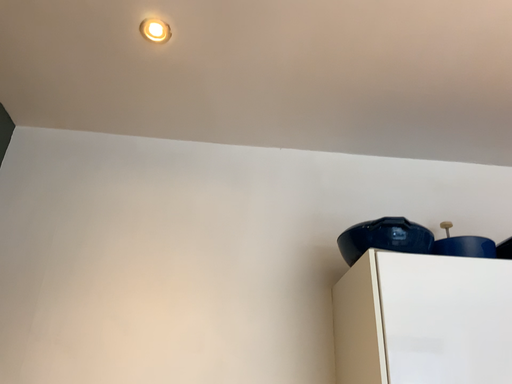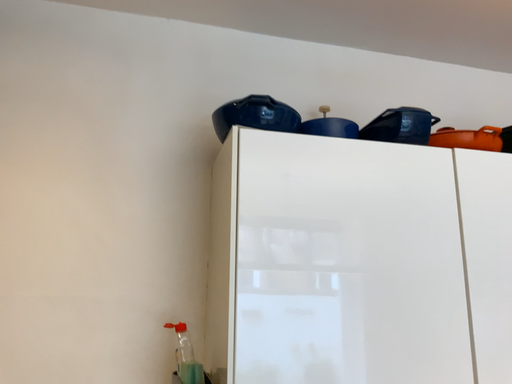
Question: Which way did the camera rotate in the video?

Choices:
 (A) rotated left
 (B) rotated right

Answer: (B)